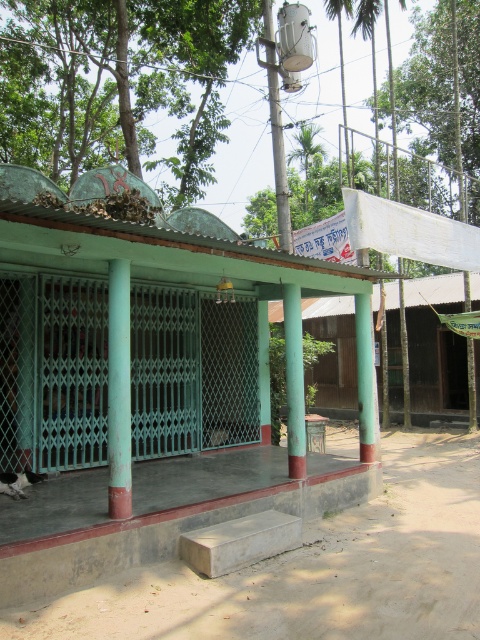
Consider the image. You are standing in front of the structure and want to determine the relative positions of two points marked in the image. Which point is closer to you, point (109, 500) or point (295, 460)?

Point (109, 500) is closer to the viewer than point (295, 460).

You are standing in front of the structure and want to determine the relative positions of two points marked in the image. Which point, point (107, 204) or point (447, 333), is closer to you?

Point (107, 204) is closer to the camera than point (447, 333).

You are standing in front of the open structure and need to determine the position of the green painted metal column at center relative to the green painted wood at center. Which object is positioned to the left?

The green painted metal column at center is to the left of green painted wood at center.